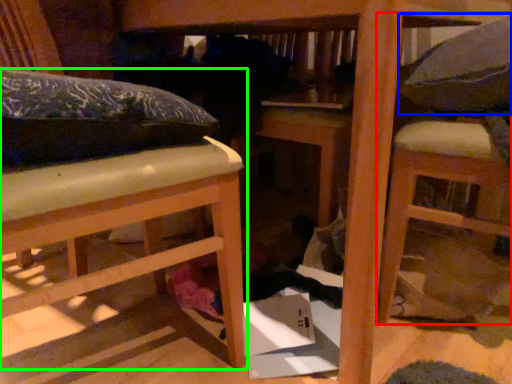
Question: Based on their relative distances, which object is farther from furniture (highlighted by a red box)? Choose from pillow (highlighted by a blue box) and furniture (highlighted by a green box).

Choices:
 (A) pillow
 (B) furniture

Answer: (B)